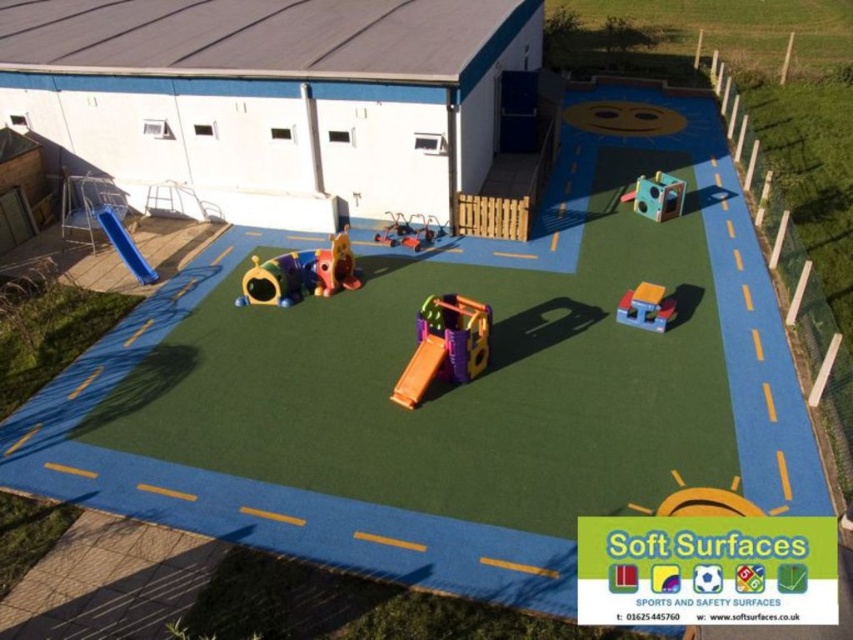
You are standing at the point marked as point (300, 275) in the children play area. Which play structure are you currently standing on?

You are standing on the rubberized multicolored play structure at center left.

You are a parent trying to fit a new toy box into the play area. The toy box is 1.2 meters wide. You see the matte multicolored cube at upper right and the rubberized yellow slide at center. Which of these two items has enough space to accommodate the toy box next to it?

The matte multicolored cube at upper right has a larger width than the rubberized yellow slide at center, so it would have more space to accommodate the 1.2 meter wide toy box next to it.

You are a parent standing at the entrance of the play area and want to ensure your child can walk from the matte multicolored cube at upper right to the rubberized yellow slide at center without needing to go outside the play area. Can they do this?

The matte multicolored cube at upper right is 39.77 feet away from the rubberized yellow slide at center. Since the play area is enclosed by a blue border with yellow dashed lines, the child can walk between them within the play area as the distance is covered without leaving the enclosed space.